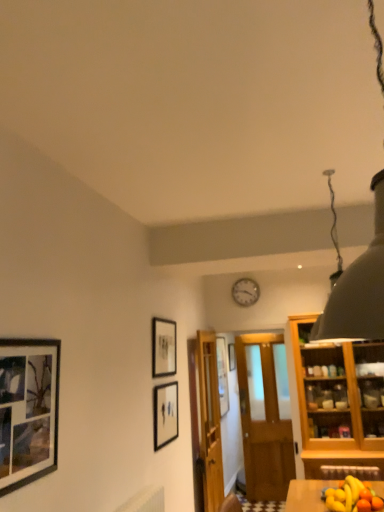
Question: Considering the relative sizes of matte black picture frame at upper center, the 3th picture frame viewed from the front, and wooden door at center, marked as the 1th door in a left-to-right arrangement, in the image provided, is matte black picture frame at upper center, the 3th picture frame viewed from the front, taller than wooden door at center, marked as the 1th door in a left-to-right arrangement,?

Choices:
 (A) yes
 (B) no

Answer: (B)

Question: From the image's perspective, does matte black picture frame at upper center, which appears as the 2th picture frame when viewed from the left, appear higher than wooden door at center, which is the 2th door in right-to-left order?

Choices:
 (A) yes
 (B) no

Answer: (A)

Question: From a real-world perspective, does matte black picture frame at upper center, which is the 3th picture frame in back-to-front order, sit lower than wooden door at center, which is the 2th door in right-to-left order?

Choices:
 (A) yes
 (B) no

Answer: (B)

Question: Is matte black picture frame at upper center, which is the 3th picture frame in back-to-front order, next to wooden door at center, marked as the 1th door in a left-to-right arrangement?

Choices:
 (A) yes
 (B) no

Answer: (B)

Question: Is matte black picture frame at upper center, the 4th picture frame when ordered from right to left, aimed at wooden door at center, marked as the 1th door in a left-to-right arrangement?

Choices:
 (A) yes
 (B) no

Answer: (B)

Question: Is the position of matte black picture frame at upper center, which is the 3th picture frame in back-to-front order, more distant than that of wooden door at center, which is the 2th door in right-to-left order?

Choices:
 (A) yes
 (B) no

Answer: (B)

Question: Is black matte picture frame at upper center, placed as the 1th picture frame when sorted from back to front, at the right side of matte black picture frame at center, positioned as the 3th picture frame in right-to-left order?

Choices:
 (A) yes
 (B) no

Answer: (A)

Question: Is black matte picture frame at upper center, arranged as the 4th picture frame when viewed from the left, shorter than matte black picture frame at center, positioned as the 3th picture frame in right-to-left order?

Choices:
 (A) no
 (B) yes

Answer: (B)

Question: Would you say black matte picture frame at upper center, acting as the fifth picture frame starting from the front, is outside matte black picture frame at center, the fourth picture frame positioned from the back?

Choices:
 (A) yes
 (B) no

Answer: (A)

Question: From the image's perspective, is black matte picture frame at upper center, acting as the fifth picture frame starting from the front, beneath matte black picture frame at center, positioned as the 3th picture frame in right-to-left order?

Choices:
 (A) no
 (B) yes

Answer: (B)

Question: Considering the relative sizes of black matte picture frame at upper center, arranged as the 4th picture frame when viewed from the left, and matte black picture frame at center, the fourth picture frame positioned from the back, in the image provided, is black matte picture frame at upper center, arranged as the 4th picture frame when viewed from the left, thinner than matte black picture frame at center, the fourth picture frame positioned from the back,?

Choices:
 (A) yes
 (B) no

Answer: (B)

Question: Is the position of black matte picture frame at upper center, the second picture frame when ordered from right to left, more distant than that of matte black picture frame at center, the fourth picture frame positioned from the back?

Choices:
 (A) no
 (B) yes

Answer: (B)

Question: Is wooden door at center, marked as the 1th door in a left-to-right arrangement, not close to wooden table at lower right?

Choices:
 (A) no
 (B) yes

Answer: (B)